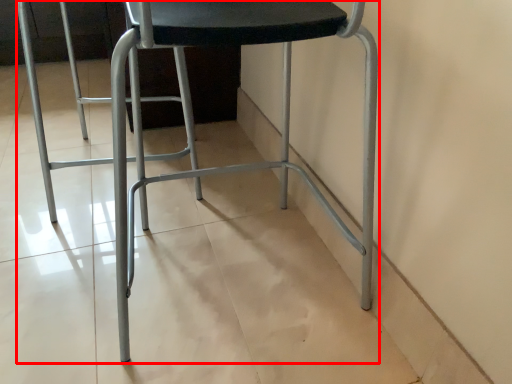
Question: Observing the image, what is the correct spatial positioning of chair (annotated by the red box) in reference to swivel chair?

Choices:
 (A) right
 (B) left

Answer: (A)